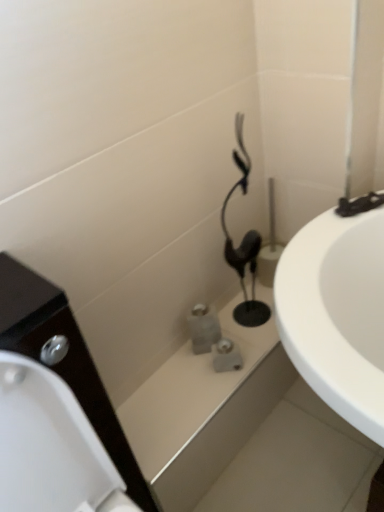
The width and height of the screenshot is (384, 512). In order to click on space that is in front of black plastic hairdryer at center in this screenshot , I will do `click(244, 351)`.